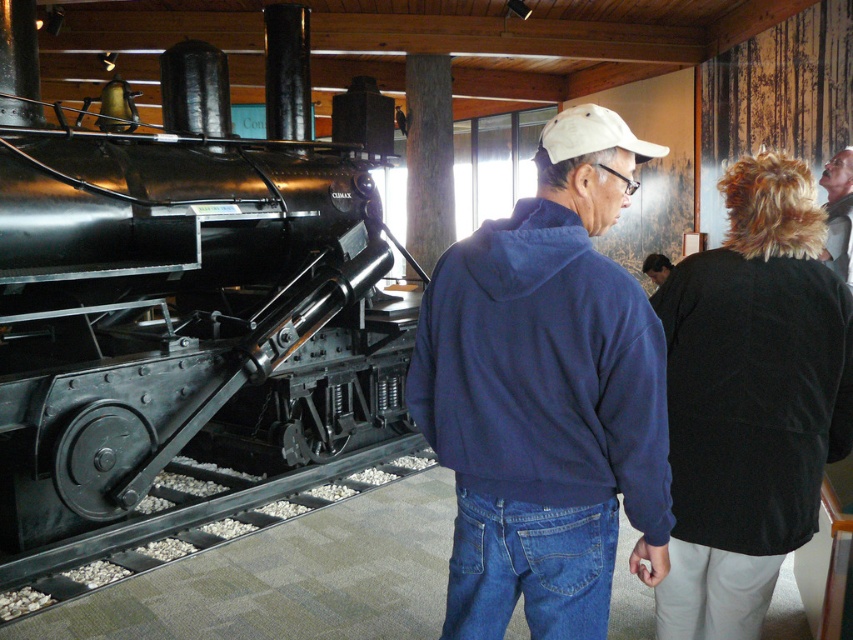
You are a visitor at the museum and want to take a photo of the polished black locomotive at left and the black metal train track at lower left. Which object is positioned higher in the image?

The polished black locomotive at left is positioned higher than the black metal train track at lower left in the image.

You are a tour guide at the museum and want to point out the blue fleece jacket at center to a visitor. Which direction should you look relative to the smooth blonde hair at upper right?

The blue fleece jacket at center is in front of the smooth blonde hair at upper right, so you should look downward from the smooth blonde hair at upper right to locate the blue fleece jacket at center.

You are a museum security guard and need to ensure that the blue fleece jacket at center and the smooth blonde hair at upper right are within the restricted area. The restricted area has a minimum size requirement of 1.5 meters. Can both objects meet this requirement?

The blue fleece jacket at center is larger in size than smooth blonde hair at upper right. Since the blue fleece jacket at center is larger and meets the minimum size requirement of 1.5 meters, both objects can be within the restricted area.